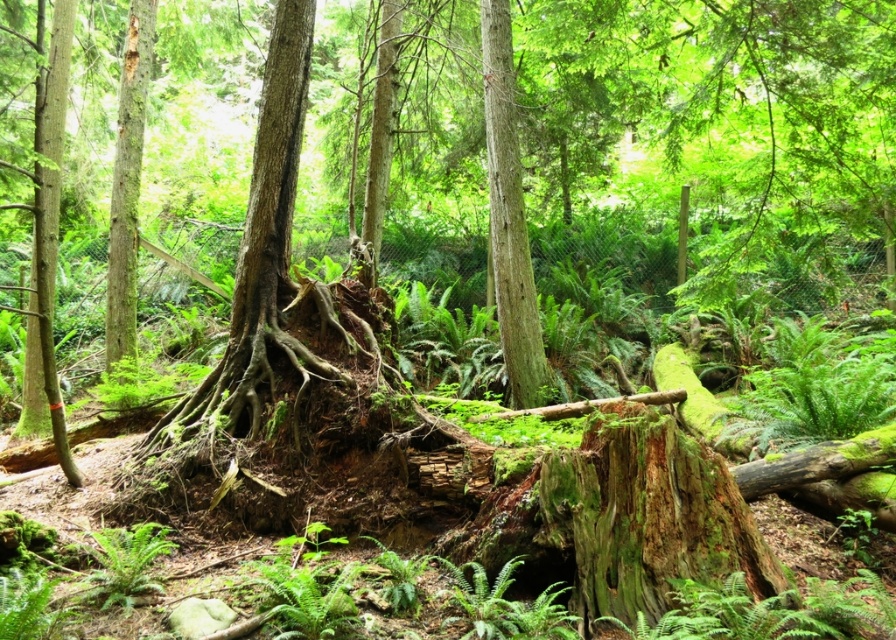
You are a hiker who wants to place a small backpack between the smooth brown tree trunk at center and the green fuzzy fern at lower left. Which object should you place the backpack closer to if you want it to be near the larger object?

The smooth brown tree trunk at center is larger than the green fuzzy fern at lower left, so you should place the backpack closer to the smooth brown tree trunk at center.

You are standing in the forest and see a point marked at coordinates (x=509, y=216). According to the image, where exactly is this point located?

The point is located on the smooth brown tree trunk at center.

You are a hiker who wants to place a small flag on the tallest object between the smooth brown tree trunk at left and the green fuzzy fern at lower left. Which object should you choose?

The smooth brown tree trunk at left is taller than the green fuzzy fern at lower left, so you should place the flag on the smooth brown tree trunk at left.